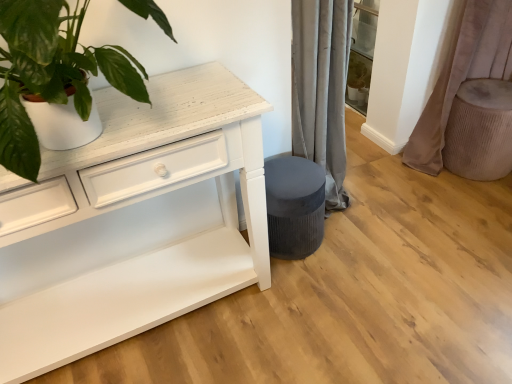
Identify the location of free space in front of beige textured ottoman at right. (478, 209).